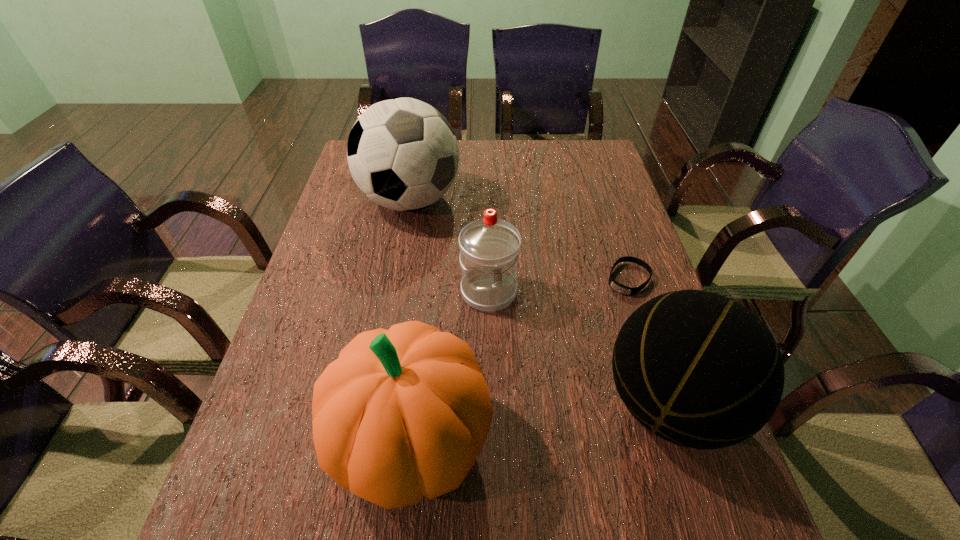
At what (x,y) coordinates should I click in order to perform the action: click on free space located 0.080m on the main logo of the soccer ball. Please return your answer as a coordinate pair (x, y). Image resolution: width=960 pixels, height=540 pixels. Looking at the image, I should click on (433, 248).

Find the location of a particular element. The width and height of the screenshot is (960, 540). vacant space located 0.120m on the main logo of the soccer ball is located at coordinates (438, 258).

The image size is (960, 540). Identify the location of free location located 0.380m on the main logo of the soccer ball. (472, 328).

Identify the location of vacant space located 0.170m on the handle side of the water bottle. [x=528, y=369].

Where is `vacant space located 0.180m on the handle side of the water bottle`? The width and height of the screenshot is (960, 540). vacant space located 0.180m on the handle side of the water bottle is located at coordinates (530, 373).

Find the location of a particular element. This screenshot has width=960, height=540. free space located 0.210m on the handle side of the water bottle is located at coordinates (536, 384).

Find the location of a particular element. The height and width of the screenshot is (540, 960). object that is at the far edge is located at coordinates (402, 153).

Identify the location of pumpkin located in the near edge section of the desktop. This screenshot has width=960, height=540. 402,413.

The image size is (960, 540). Identify the location of basketball present at the near edge. pos(701,371).

I want to click on object that is at the left edge, so click(x=402, y=153).